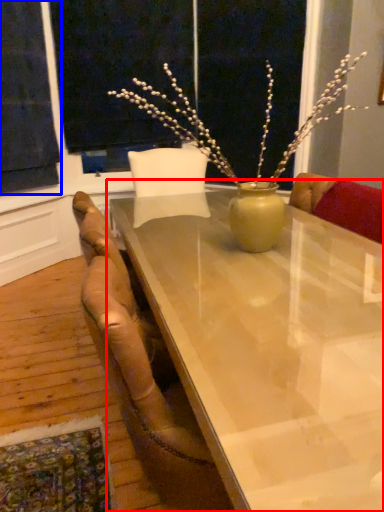
Question: Which of the following is the farthest to the observer, table (highlighted by a red box) or curtain (highlighted by a blue box)?

Choices:
 (A) table
 (B) curtain

Answer: (B)